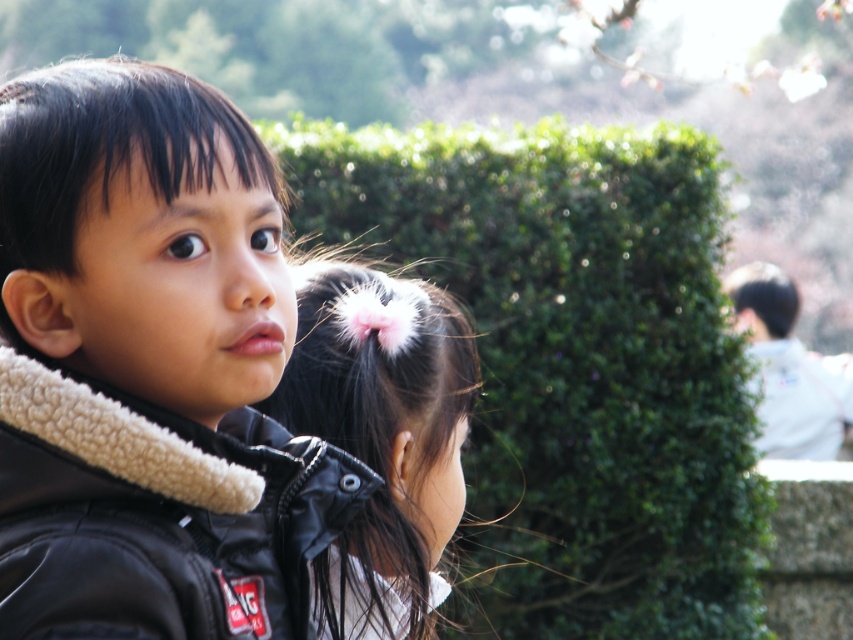
Question: Which of the following is the closest to the observer?

Choices:
 (A) black fleece jacket at left
 (B) green leafy hedge at center
 (C) black matte jacket at center
 (D) white cotton shirt at right

Answer: (A)

Question: Is green leafy hedge at center closer to camera compared to black matte jacket at center?

Choices:
 (A) yes
 (B) no

Answer: (B)

Question: Which point is closer to the camera taking this photo?

Choices:
 (A) pos(430,483)
 (B) pos(264,531)
 (C) pos(752,276)
 (D) pos(445,280)

Answer: (B)

Question: Is green leafy hedge at center to the left of black matte jacket at center from the viewer's perspective?

Choices:
 (A) no
 (B) yes

Answer: (A)

Question: Observing the image, what is the correct spatial positioning of black matte jacket at center in reference to white cotton shirt at right?

Choices:
 (A) left
 (B) right

Answer: (A)

Question: Estimate the real-world distances between objects in this image. Which object is closer to the black matte jacket at center?

Choices:
 (A) black fleece jacket at left
 (B) green leafy hedge at center
 (C) white cotton shirt at right

Answer: (A)